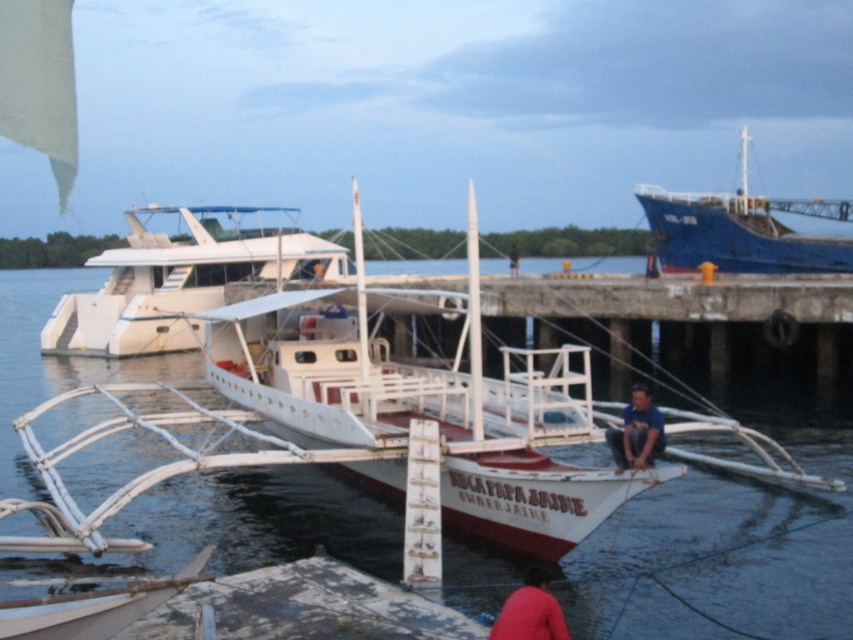
Consider the image. Is the position of red fabric shirt at lower center less distant than that of dark blue shirt at center?

Yes, red fabric shirt at lower center is closer to the viewer.

Consider the image. Measure the distance between point (x=549, y=634) and camera.

→ Point (x=549, y=634) is 7.00 meters away from camera.

The image size is (853, 640). In order to click on red fabric shirt at lower center in this screenshot , I will do `click(531, 611)`.

Between white matte yacht at center and blue matte ship at upper right, which one has less height?

Standing shorter between the two is white matte yacht at center.

Is point (173, 243) farther from viewer compared to point (820, 241)?

Yes, it is behind point (820, 241).

Does point (200, 220) come closer to viewer compared to point (756, 266)?

No, it is not.

What are the coordinates of `white matte yacht at center` in the screenshot? It's located at (178, 282).

Is transparent water at boat center bigger than blue fabric shirt at center?

Correct, transparent water at boat center is larger in size than blue fabric shirt at center.

Who is more forward, (x=78, y=362) or (x=619, y=432)?

Positioned in front is point (x=619, y=432).

What are the coordinates of `transparent water at boat center` in the screenshot? It's located at (727, 541).